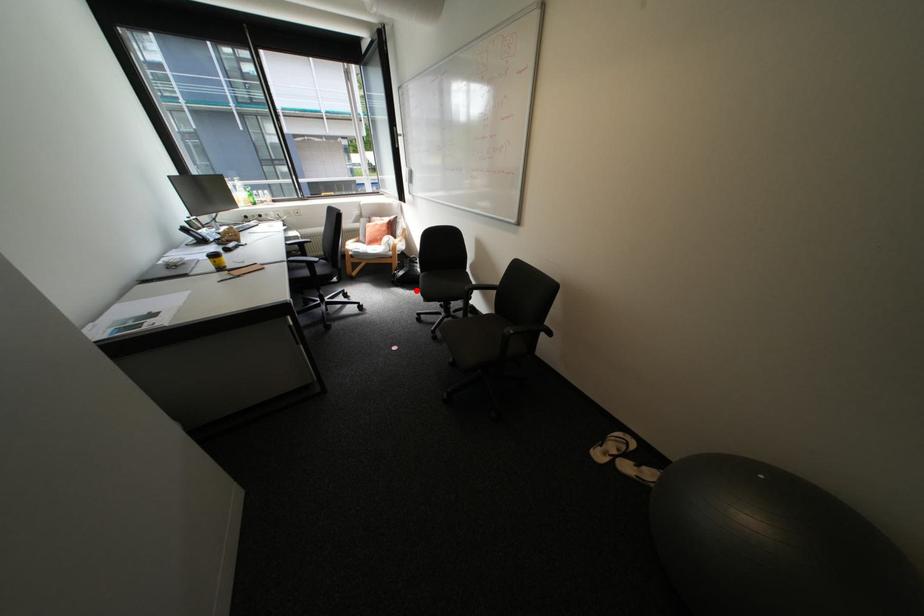
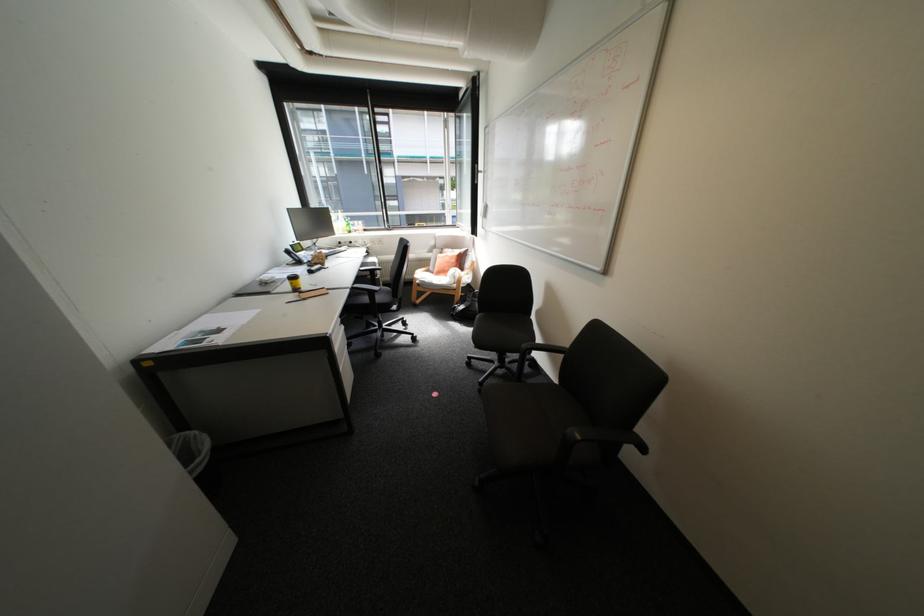
In the second image, find the point that corresponds to the highlighted location in the first image.

(473, 326)